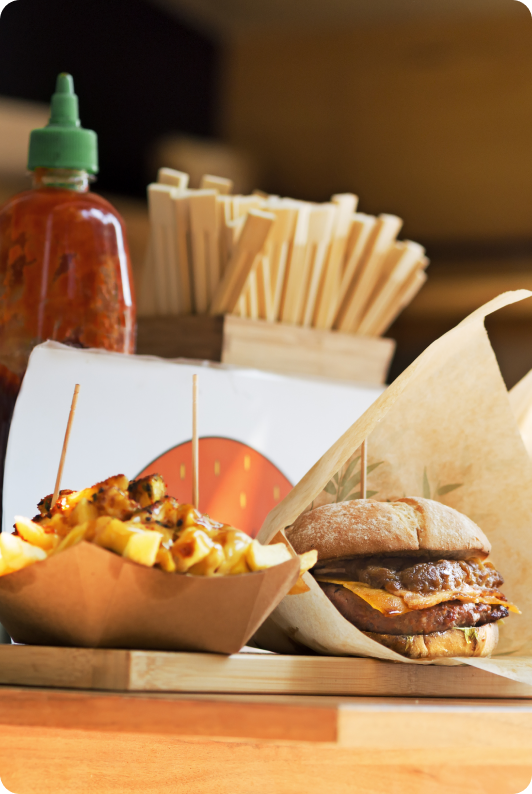
The height and width of the screenshot is (794, 532). What are the coordinates of `chopsticks` in the screenshot? It's located at (247, 256).